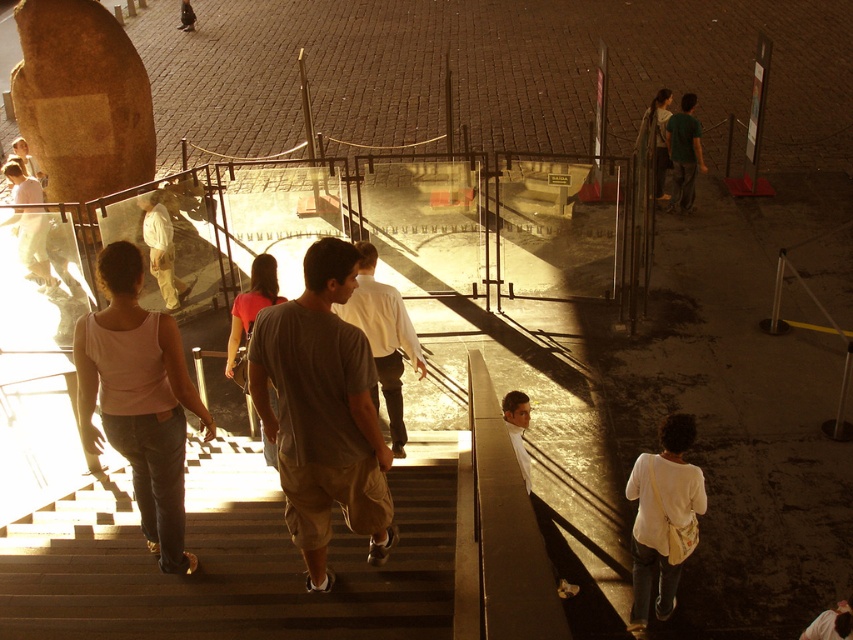
Is point (138, 196) more distant than point (653, 108)?

That is False.

Consider the image. Who is more forward, (166, 257) or (651, 109)?

Positioned in front is point (166, 257).

The width and height of the screenshot is (853, 640). I want to click on light beige pants at center, so click(x=161, y=250).

Who is shorter, light brown cotton t-shirt at center or light brown leather jacket at lower right?

With less height is light brown leather jacket at lower right.

Who is more forward, (x=361, y=342) or (x=506, y=396)?

Point (x=361, y=342) is more forward.

Who is more distant from viewer, (x=312, y=502) or (x=529, y=472)?

Point (x=529, y=472)

The width and height of the screenshot is (853, 640). What are the coordinates of `light brown cotton t-shirt at center` in the screenshot? It's located at (322, 412).

Is gray cotton shirt at center further to the viewer compared to light brown leather jacket at lower right?

Yes, gray cotton shirt at center is further from the viewer.

Where is `gray cotton shirt at center`? This screenshot has height=640, width=853. gray cotton shirt at center is located at coordinates (383, 337).